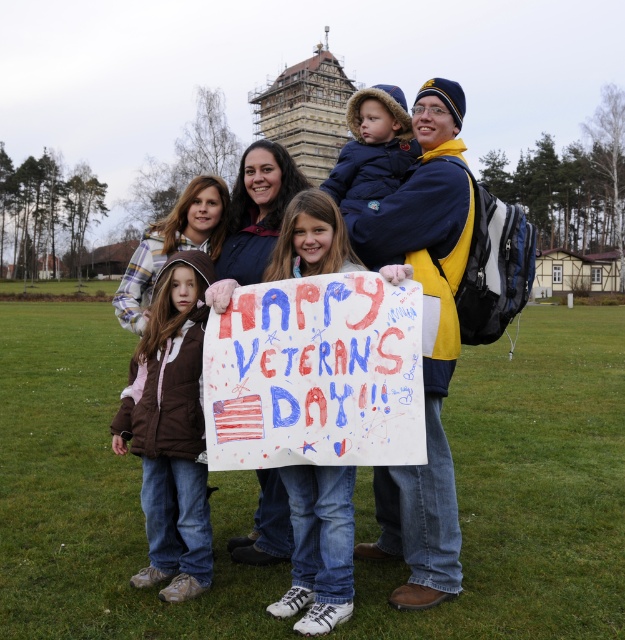
Question: Which point is closer to the camera?

Choices:
 (A) hand-drawn paper sign at center
 (B) brown fleece jacket at lower left
 (C) matte white sign at center

Answer: (C)

Question: Is hand-drawn paper sign at center wider than brown fleece jacket at lower left?

Choices:
 (A) yes
 (B) no

Answer: (B)

Question: Among these objects, which one is farthest from the camera?

Choices:
 (A) dark blue fleece jacket at center
 (B) brown fleece jacket at lower left
 (C) hand-drawn paper sign at center

Answer: (A)

Question: Which point is closer to the camera taking this photo?

Choices:
 (A) 400,157
 (B) 476,260
 (C) 360,273
 (D) 182,260

Answer: (C)

Question: Can you confirm if matte white sign at center is positioned below dark blue fleece jacket at center?

Choices:
 (A) yes
 (B) no

Answer: (A)

Question: Does brown fleece jacket at lower left have a larger size compared to dark blue fleece jacket at center?

Choices:
 (A) no
 (B) yes

Answer: (A)